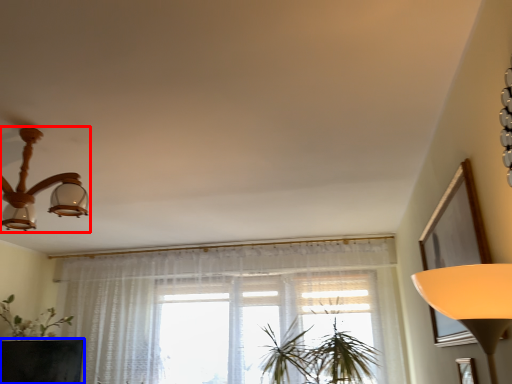
Question: Which point is further to the camera, lamp (highlighted by a red box) or round table (highlighted by a blue box)?

Choices:
 (A) lamp
 (B) round table

Answer: (B)